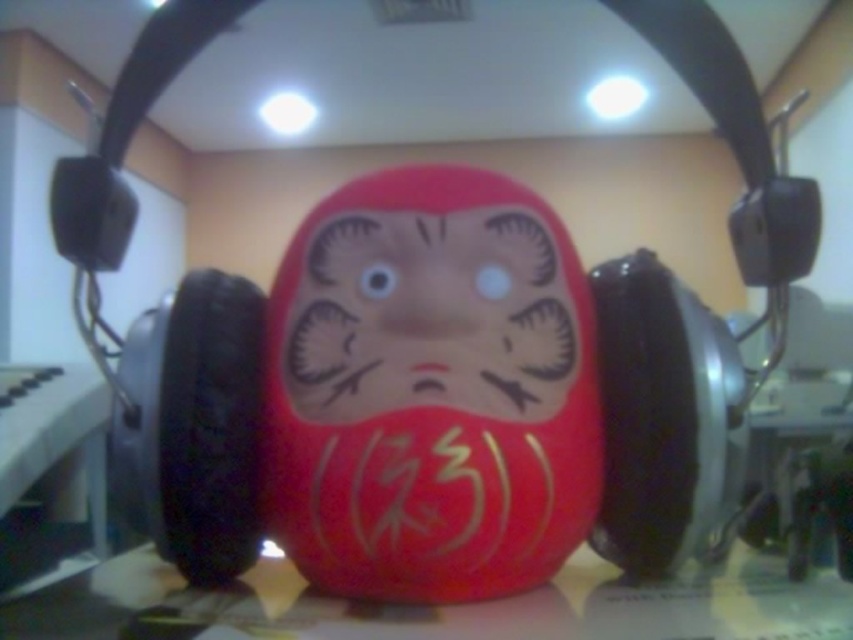
Question: Which point is farther to the camera?

Choices:
 (A) matte red daruma doll at center
 (B) matte plastic table at center

Answer: (A)

Question: Does matte red daruma doll at center lie in front of matte plastic table at center?

Choices:
 (A) yes
 (B) no

Answer: (B)

Question: Which point appears closest to the camera in this image?

Choices:
 (A) (494, 625)
 (B) (329, 404)

Answer: (A)

Question: Does matte red daruma doll at center lie behind matte plastic table at center?

Choices:
 (A) yes
 (B) no

Answer: (A)

Question: Is matte red daruma doll at center closer to the viewer compared to matte plastic table at center?

Choices:
 (A) no
 (B) yes

Answer: (A)